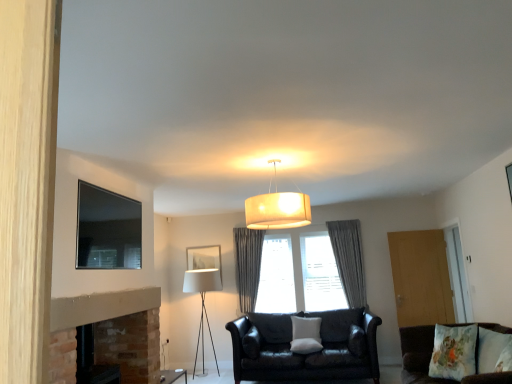
Question: Is matte black tv at upper left, which is counted as the 1th picture frame, starting from the top, wider than white fabric lampshade at lower left?

Choices:
 (A) no
 (B) yes

Answer: (A)

Question: From the image's perspective, would you say matte black tv at upper left, the second picture frame positioned from the back, is shown under white fabric lampshade at lower left?

Choices:
 (A) yes
 (B) no

Answer: (B)

Question: Can white fabric lampshade at lower left be found inside matte black tv at upper left, the second picture frame ordered from the bottom?

Choices:
 (A) yes
 (B) no

Answer: (B)

Question: Can you confirm if matte black tv at upper left, the 1th picture frame in the left-to-right sequence, is positioned to the right of white fabric lampshade at lower left?

Choices:
 (A) yes
 (B) no

Answer: (B)

Question: Can you confirm if matte black tv at upper left, the second picture frame ordered from the bottom, is smaller than white fabric lampshade at lower left?

Choices:
 (A) yes
 (B) no

Answer: (A)

Question: Can you confirm if matte black tv at upper left, the 1th picture frame positioned from the front, is shorter than white fabric lampshade at lower left?

Choices:
 (A) no
 (B) yes

Answer: (B)

Question: Are transparent glass door at right, which ranks as the first glass door in right-to-left order, and gray fabric curtain at center, which is counted as the first curtain, starting from the right, located far from each other?

Choices:
 (A) yes
 (B) no

Answer: (A)

Question: Considering the relative sizes of transparent glass door at right, which ranks as the second glass door in left-to-right order, and gray fabric curtain at center, marked as the second curtain in a left-to-right arrangement, in the image provided, is transparent glass door at right, which ranks as the second glass door in left-to-right order, shorter than gray fabric curtain at center, marked as the second curtain in a left-to-right arrangement,?

Choices:
 (A) no
 (B) yes

Answer: (A)

Question: Is gray fabric curtain at center, which is counted as the first curtain, starting from the right, completely or partially inside transparent glass door at right, which ranks as the second glass door in left-to-right order?

Choices:
 (A) yes
 (B) no

Answer: (B)

Question: Is transparent glass door at right, which ranks as the second glass door in left-to-right order, next to gray fabric curtain at center, which is counted as the first curtain, starting from the right?

Choices:
 (A) no
 (B) yes

Answer: (A)

Question: Is transparent glass door at right, which ranks as the second glass door in left-to-right order, wider than gray fabric curtain at center, which is counted as the first curtain, starting from the right?

Choices:
 (A) no
 (B) yes

Answer: (A)

Question: From the image's perspective, does transparent glass door at right, which ranks as the second glass door in left-to-right order, appear lower than gray fabric curtain at center, which is counted as the first curtain, starting from the right?

Choices:
 (A) yes
 (B) no

Answer: (B)

Question: From the image's perspective, is fluffy floral pillow at lower right, arranged as the 1th pillow when viewed from the front, above wooden door at right, the second glass door positioned from the right?

Choices:
 (A) yes
 (B) no

Answer: (A)